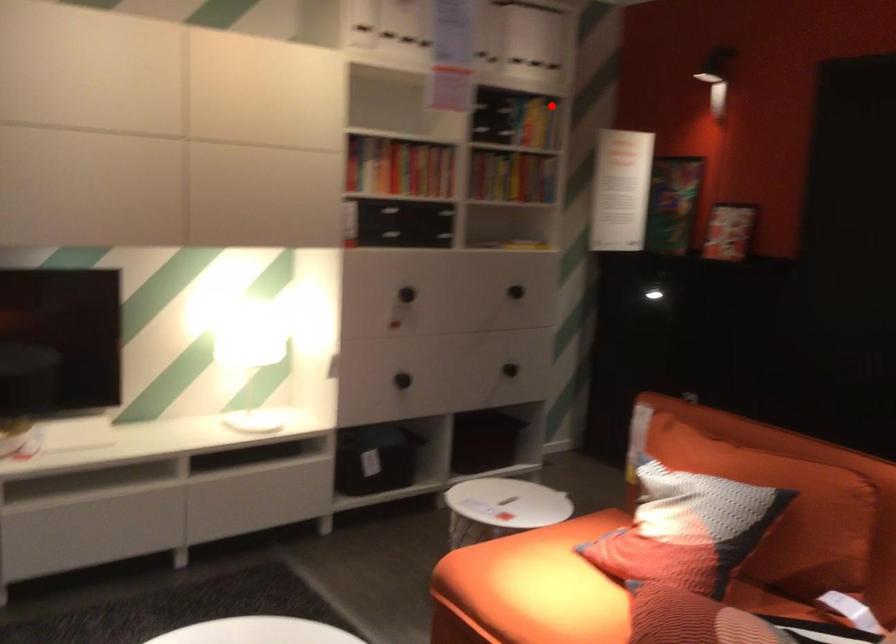
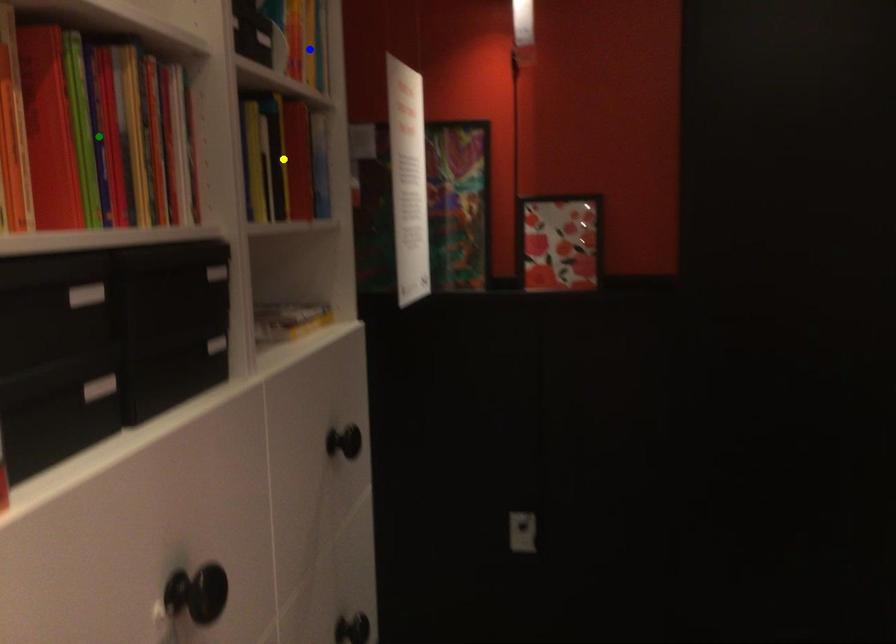
Question: I am providing you with two images of the same scene from different viewpoints. A red point is marked on the first image. You are given multiple points on the second image. In image 2, which mark is for the same physical point as the one in image 1?

Choices:
 (A) blue point
 (B) green point
 (C) yellow point

Answer: (A)